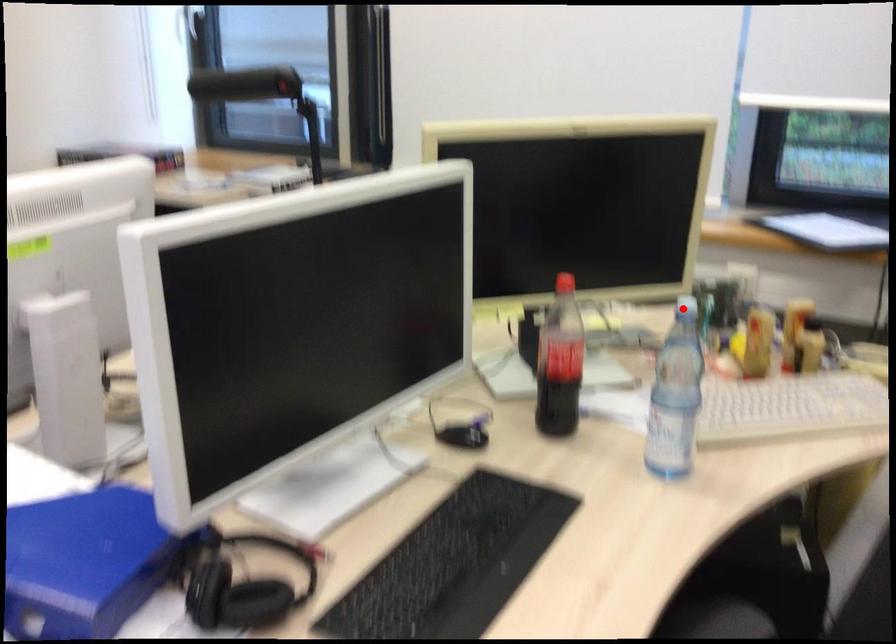
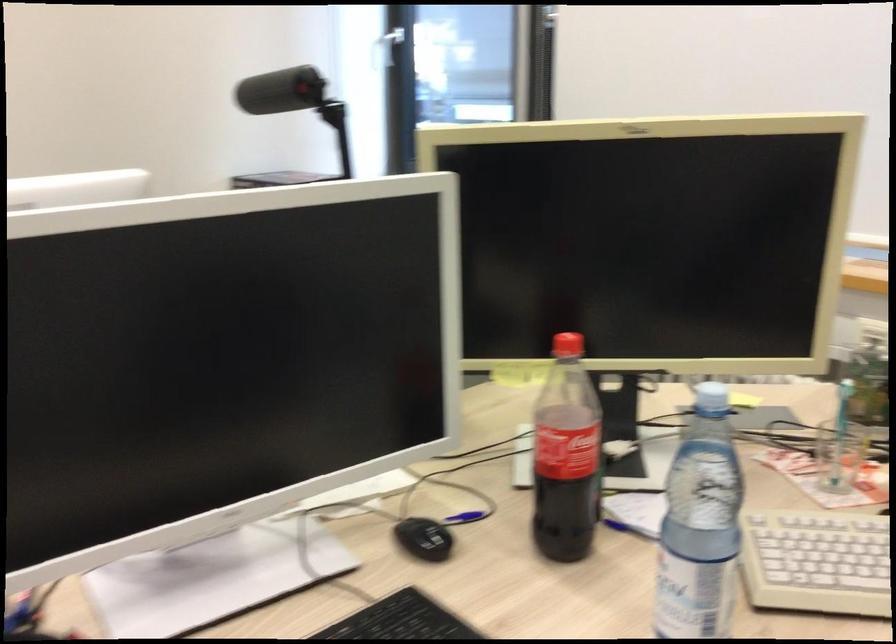
Where in the second image is the point corresponding to the highlighted location from the first image?

(711, 398)